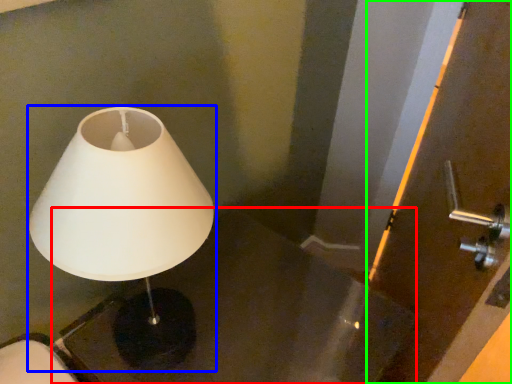
Question: Estimate the real-world distances between objects in this image. Which object is farther from table (highlighted by a red box), lamp (highlighted by a blue box) or screen door (highlighted by a green box)?

Choices:
 (A) lamp
 (B) screen door

Answer: (A)